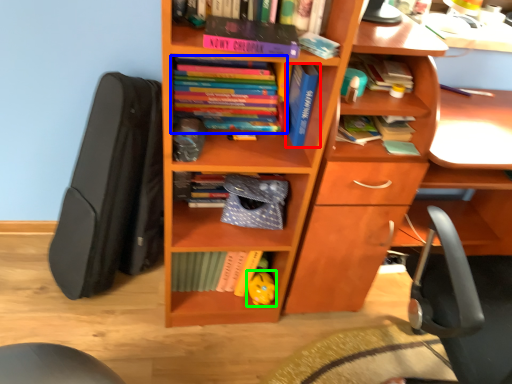
Question: Based on their relative distances, which object is nearer to book (highlighted by a red box)? Choose from book (highlighted by a blue box) and toy (highlighted by a green box).

Choices:
 (A) book
 (B) toy

Answer: (A)